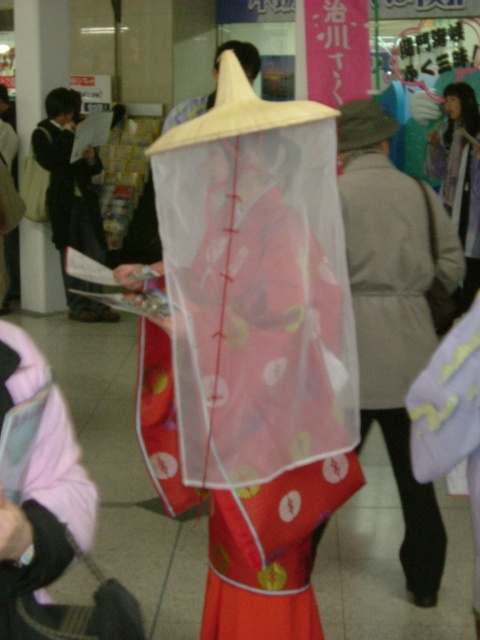
Question: Is matte black jacket at left above matte pink kimono at center?

Choices:
 (A) yes
 (B) no

Answer: (B)

Question: Among these objects, which one is nearest to the camera?

Choices:
 (A) matte pink kimono at center
 (B) matte red kimono at center

Answer: (B)

Question: Which object appears closest to the camera in this image?

Choices:
 (A) matte black jacket at left
 (B) matte red kimono at center

Answer: (B)

Question: In this image, where is matte red kimono at center located relative to matte pink kimono at center?

Choices:
 (A) above
 (B) below

Answer: (B)

Question: Does matte red kimono at center have a smaller size compared to matte pink kimono at center?

Choices:
 (A) yes
 (B) no

Answer: (A)

Question: Which of the following is the closest to the observer?

Choices:
 (A) (471, 173)
 (B) (48, 132)

Answer: (B)